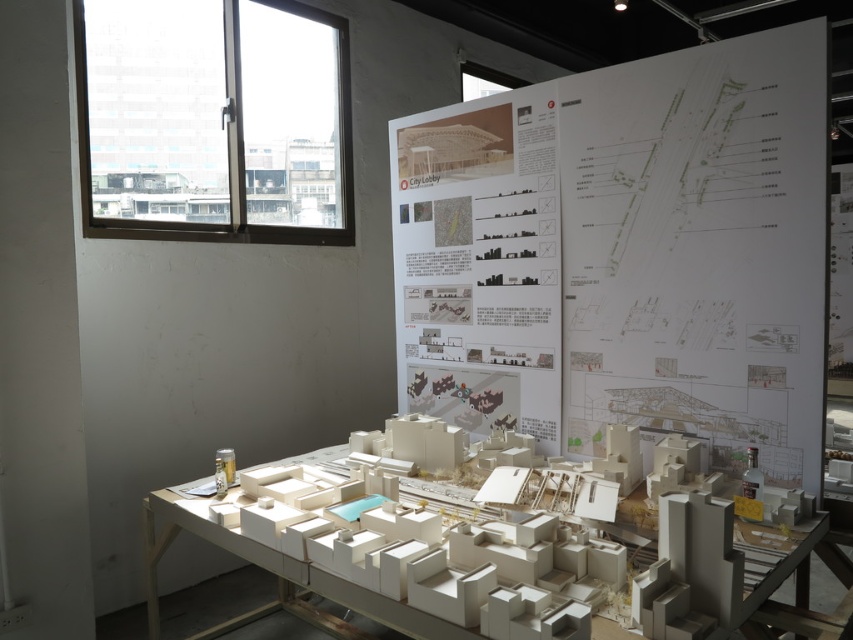
Is white paper poster at upper center thinner than white cardboard model at center?

Yes.

Is point (566, 80) positioned before point (701, 556)?

No, (566, 80) is further to viewer.

At what (x,y) coordinates should I click in order to perform the action: click on white paper poster at upper center. Please return your answer as a coordinate pair (x, y). The image size is (853, 640). Looking at the image, I should click on (625, 253).